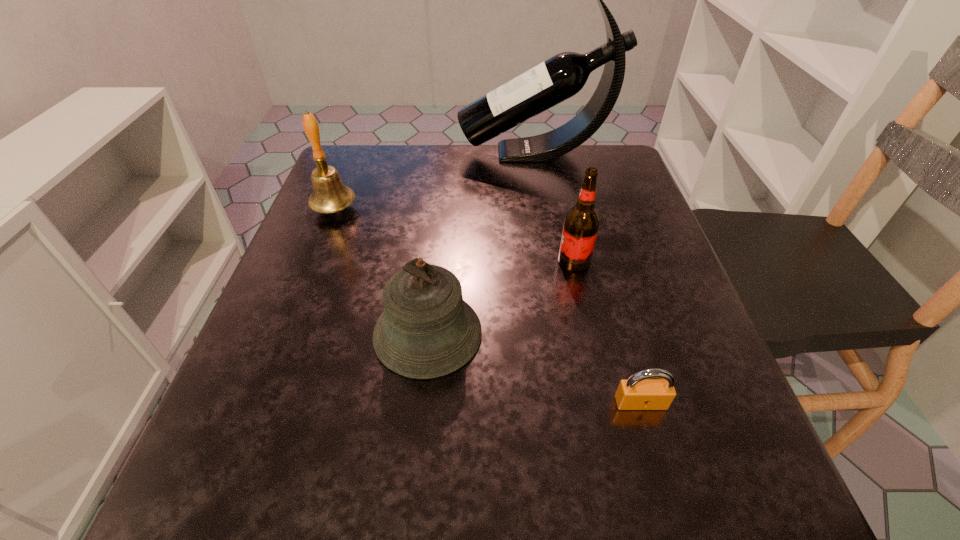
This screenshot has height=540, width=960. In order to click on the tallest object in this screenshot , I will do `click(562, 76)`.

This screenshot has width=960, height=540. What are the coordinates of `the farthest object` in the screenshot? It's located at (562, 76).

The width and height of the screenshot is (960, 540). What are the coordinates of `the left bell` in the screenshot? It's located at (329, 195).

Where is `the taller bell`? the taller bell is located at coordinates (329, 195).

This screenshot has height=540, width=960. I want to click on root beer, so click(x=581, y=224).

Image resolution: width=960 pixels, height=540 pixels. What are the coordinates of `the right bell` in the screenshot? It's located at (427, 330).

Identify the location of the shorter bell. (427, 330).

Where is `the nearest object`? This screenshot has height=540, width=960. the nearest object is located at coordinates (639, 392).

The image size is (960, 540). I want to click on the shortest object, so click(639, 392).

Where is `vacant area situated on the stand of the farthest object`? Image resolution: width=960 pixels, height=540 pixels. vacant area situated on the stand of the farthest object is located at coordinates (356, 153).